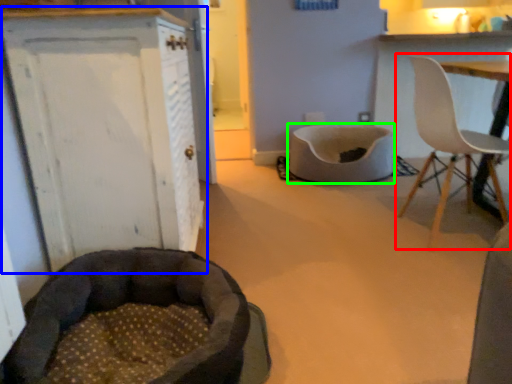
Question: Estimate the real-world distances between objects in this image. Which object is closer to chair (highlighted by a red box), cabinetry (highlighted by a blue box) or cat bed (highlighted by a green box)?

Choices:
 (A) cabinetry
 (B) cat bed

Answer: (B)